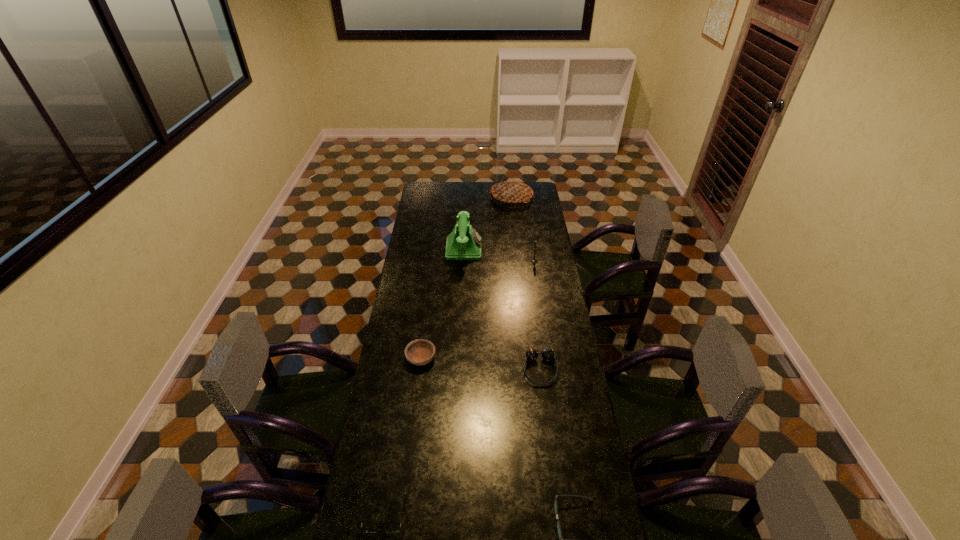
Where is `pie`? pie is located at coordinates (512, 191).

The image size is (960, 540). Find the location of `telephone`. telephone is located at coordinates (464, 243).

Find the location of a particular element. candle is located at coordinates (533, 260).

The image size is (960, 540). Identify the location of goggles. (548, 354).

I want to click on bowl, so click(x=419, y=352).

Where is `the shorter spectacles`? the shorter spectacles is located at coordinates (364, 529).

At what (x,y) coordinates should I click in order to perform the action: click on the left spectacles. Please return your answer as a coordinate pair (x, y). Image resolution: width=960 pixels, height=540 pixels. Looking at the image, I should click on (364, 529).

Identify the location of vacant region located on the left of the farthest object. click(455, 198).

What are the coordinates of `vacant space located on the dial of the telephone` in the screenshot? It's located at (517, 248).

I want to click on free space located 0.060m on the front of the fifth shortest object, so click(536, 271).